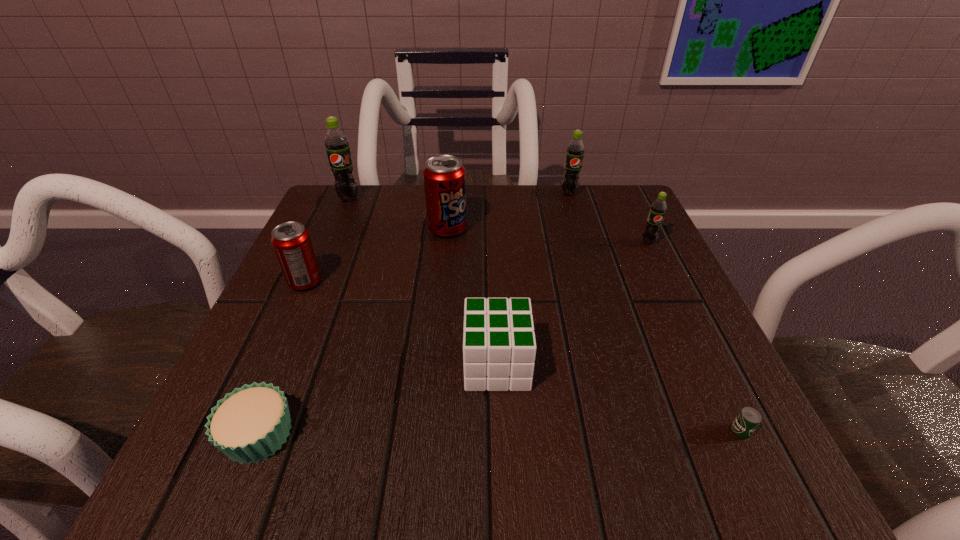
At what (x,y) coordinates should I click in order to perform the action: click on vacant space located on the red face of the fifth object from left to right. Please return your answer as a coordinate pair (x, y). The height and width of the screenshot is (540, 960). Looking at the image, I should click on (406, 365).

Locate an element on the screen. The width and height of the screenshot is (960, 540). free spot located 0.070m on the red face of the fifth object from left to right is located at coordinates (420, 365).

Find the location of `vacant space located 0.340m on the right of the seventh tallest object`. vacant space located 0.340m on the right of the seventh tallest object is located at coordinates (550, 434).

This screenshot has width=960, height=540. Find the location of `vacant space located 0.170m on the left of the beer can`. vacant space located 0.170m on the left of the beer can is located at coordinates (601, 431).

I want to click on cupcake positioned at the near edge, so click(x=248, y=425).

Locate an element on the screen. beer can at the near edge is located at coordinates (748, 419).

Identify the location of cupcake at the left edge. The height and width of the screenshot is (540, 960). [248, 425].

At what (x,y) coordinates should I click in order to perform the action: click on beer can located at the right edge. Please return your answer as a coordinate pair (x, y). Looking at the image, I should click on (748, 419).

Where is `object at the far left corner`? The image size is (960, 540). object at the far left corner is located at coordinates (336, 143).

At what (x,y) coordinates should I click in order to perform the action: click on object positioned at the near left corner. Please return your answer as a coordinate pair (x, y). The width and height of the screenshot is (960, 540). Looking at the image, I should click on (248, 425).